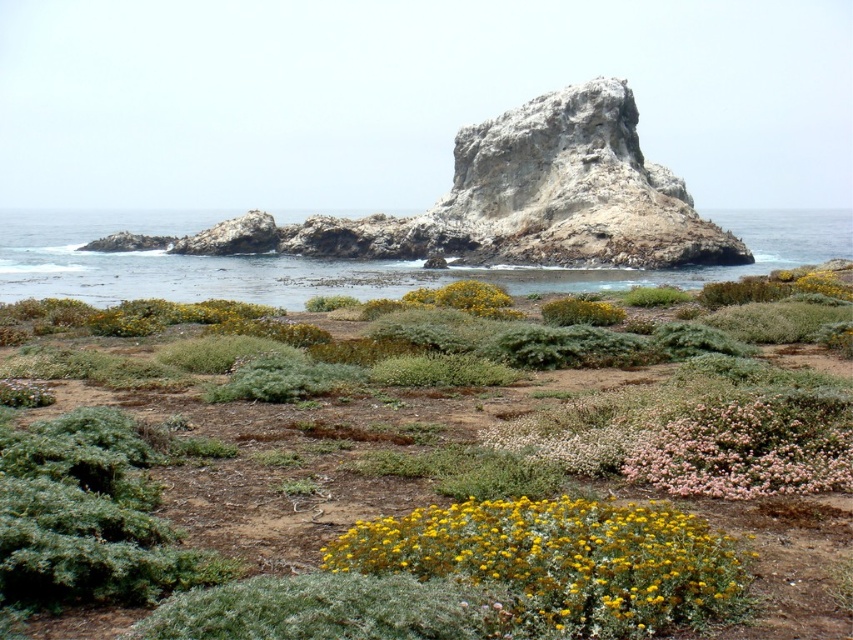
You are a photographer planning to capture the coastal landscape. You want to ensure that both the blue water at center and the pink fluffy bush at lower right are clearly visible in your shot. Given their sizes, which object should you focus on to ensure both are in frame?

The blue water at center is bigger than the pink fluffy bush at lower right, so focusing on the blue water at center will ensure both are in frame as it occupies more space in the image.

You are standing on the rocky outcrop in the middle of the ocean. You notice the blue water at center and the pink fluffy bush at lower right. Which object is closer to your right side?

The pink fluffy bush at lower right is closer to your right side because it is positioned to the right of the blue water at center.